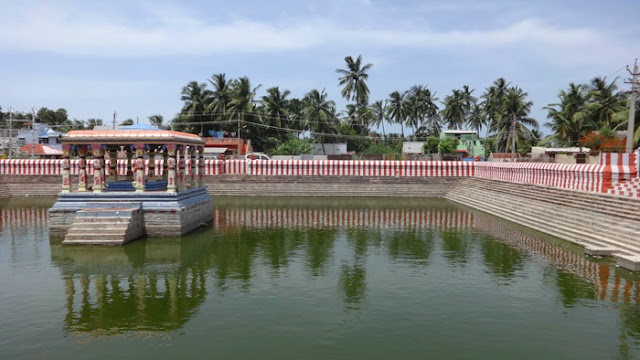
This screenshot has width=640, height=360. I want to click on pillar, so click(x=61, y=184).